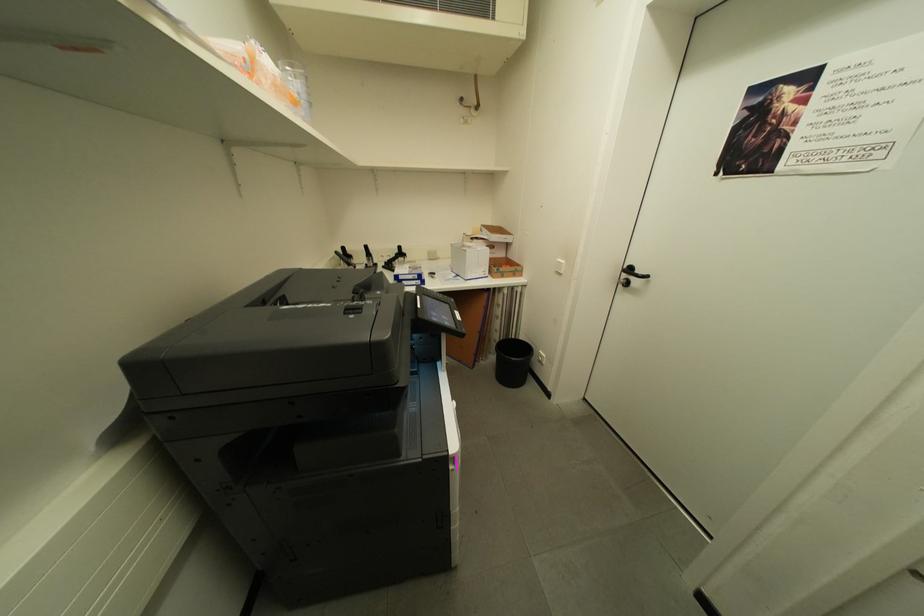
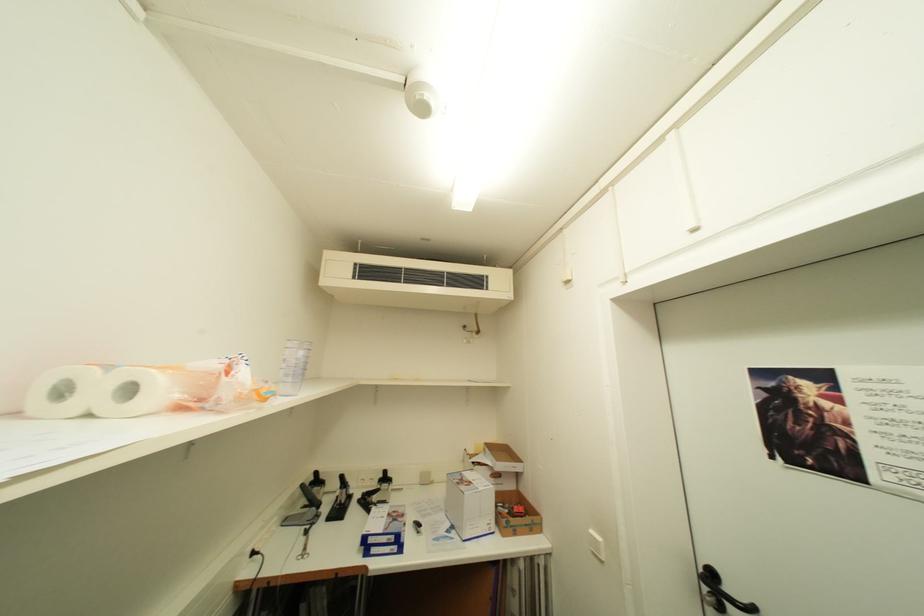
Question: The first image is from the beginning of the video and the second image is from the end. How did the camera likely rotate when shooting the video?

Choices:
 (A) Left
 (B) Right
 (C) Up
 (D) Down

Answer: (C)